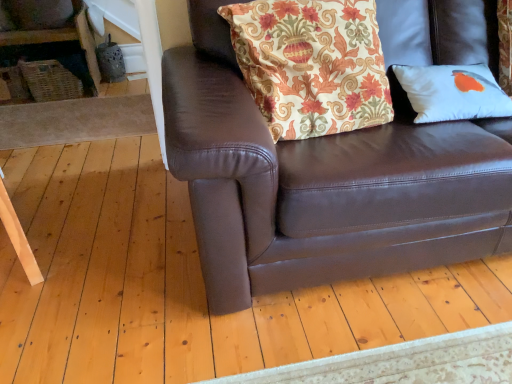
Question: Is brown leather couch at center positioned with its back to matte gray vase at upper left?

Choices:
 (A) yes
 (B) no

Answer: (A)

Question: Considering the relative sizes of brown leather couch at center and matte gray vase at upper left in the image provided, is brown leather couch at center smaller than matte gray vase at upper left?

Choices:
 (A) yes
 (B) no

Answer: (B)

Question: Can you confirm if brown leather couch at center is positioned to the left of matte gray vase at upper left?

Choices:
 (A) yes
 (B) no

Answer: (B)

Question: From a real-world perspective, is brown leather couch at center on top of matte gray vase at upper left?

Choices:
 (A) yes
 (B) no

Answer: (B)

Question: Is brown leather couch at center outside matte gray vase at upper left?

Choices:
 (A) yes
 (B) no

Answer: (A)

Question: From a real-world perspective, relative to white matte pillow at upper right, which ranks as the second pillow in left-to-right order, is matte gray vase at upper left vertically above or below?

Choices:
 (A) below
 (B) above

Answer: (B)

Question: From the image's perspective, is matte gray vase at upper left positioned above or below white matte pillow at upper right, which appears as the first pillow when viewed from the right?

Choices:
 (A) above
 (B) below

Answer: (A)

Question: Would you say matte gray vase at upper left is to the left or to the right of white matte pillow at upper right, which appears as the first pillow when viewed from the right, in the picture?

Choices:
 (A) right
 (B) left

Answer: (B)

Question: Looking at their shapes, would you say matte gray vase at upper left is wider or thinner than white matte pillow at upper right, which ranks as the second pillow in left-to-right order?

Choices:
 (A) thin
 (B) wide

Answer: (A)

Question: From a real-world perspective, is white matte pillow at upper right, which appears as the first pillow when viewed from the right, positioned above or below matte gray vase at upper left?

Choices:
 (A) below
 (B) above

Answer: (A)

Question: From the image's perspective, is white matte pillow at upper right, which appears as the first pillow when viewed from the right, above or below matte gray vase at upper left?

Choices:
 (A) above
 (B) below

Answer: (B)

Question: From their relative heights in the image, would you say white matte pillow at upper right, which ranks as the second pillow in left-to-right order, is taller or shorter than matte gray vase at upper left?

Choices:
 (A) short
 (B) tall

Answer: (A)

Question: Considering the positions of white matte pillow at upper right, which appears as the first pillow when viewed from the right, and matte gray vase at upper left in the image, is white matte pillow at upper right, which appears as the first pillow when viewed from the right, wider or thinner than matte gray vase at upper left?

Choices:
 (A) thin
 (B) wide

Answer: (B)

Question: Is white matte pillow at upper right, which appears as the first pillow when viewed from the right, in front of or behind brown leather couch at center in the image?

Choices:
 (A) front
 (B) behind

Answer: (B)

Question: Looking at their shapes, would you say white matte pillow at upper right, which ranks as the second pillow in left-to-right order, is wider or thinner than brown leather couch at center?

Choices:
 (A) wide
 (B) thin

Answer: (B)